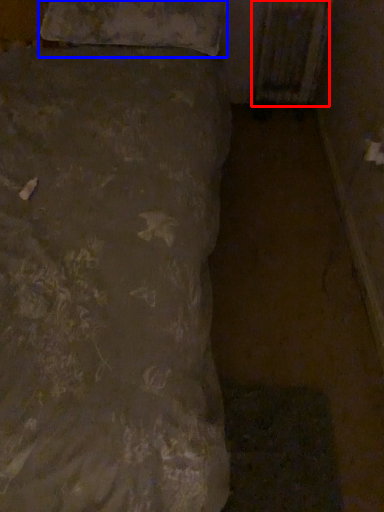
Question: Which point is closer to the camera, radiator (highlighted by a red box) or pillow (highlighted by a blue box)?

Choices:
 (A) radiator
 (B) pillow

Answer: (B)